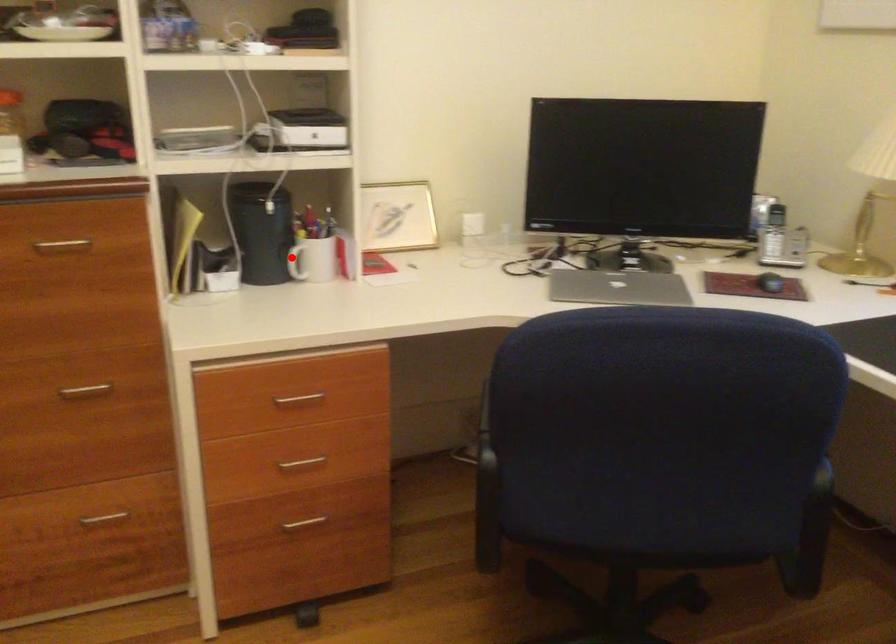
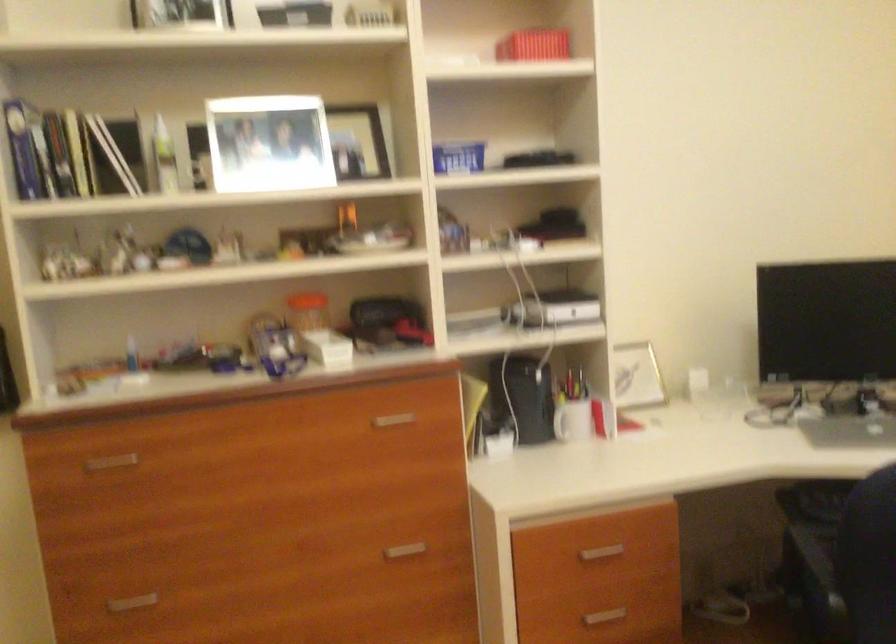
In the second image, find the point that corresponds to the highlighted location in the first image.

(560, 422)